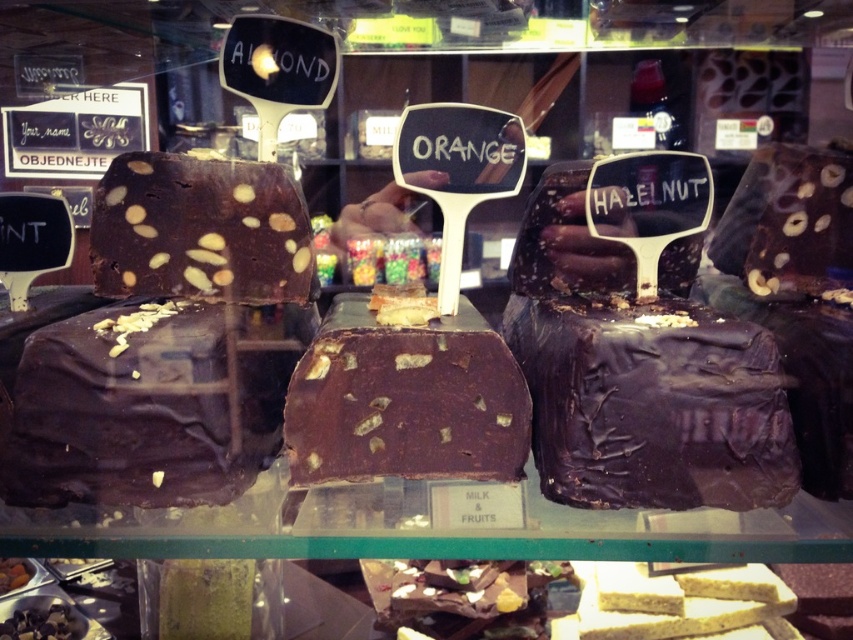
Is shiny dark chocolate cake at left shorter than shiny dark chocolate cake at center?

Correct, shiny dark chocolate cake at left is not as tall as shiny dark chocolate cake at center.

How distant is shiny dark chocolate cake at left from shiny dark chocolate cake at center?

shiny dark chocolate cake at left and shiny dark chocolate cake at center are 39.64 centimeters apart from each other.

The image size is (853, 640). Describe the element at coordinates (151, 403) in the screenshot. I see `shiny dark chocolate cake at left` at that location.

Where is `shiny dark chocolate cake at left`? shiny dark chocolate cake at left is located at coordinates (151, 403).

Between point (509, 472) and point (222, 285), which one is positioned behind?

The point (222, 285) is behind.

Does chocolatesmoothcake at center come in front of shiny dark chocolate at center?

Yes.

Who is more distant from viewer, (334, 422) or (131, 262)?

The point (131, 262) is more distant.

Locate an element on the screen. chocolatesmoothcake at center is located at coordinates (405, 401).

Is shiny dark chocolate cake at center positioned at the back of chocolatesmoothcake at center?

No.

Who is positioned more to the left, shiny dark chocolate cake at center or chocolatesmoothcake at center?

chocolatesmoothcake at center

Is point (705, 372) positioned in front of point (300, 364)?

Yes, it is in front of point (300, 364).

Locate an element on the screen. The image size is (853, 640). shiny dark chocolate cake at center is located at coordinates (653, 403).